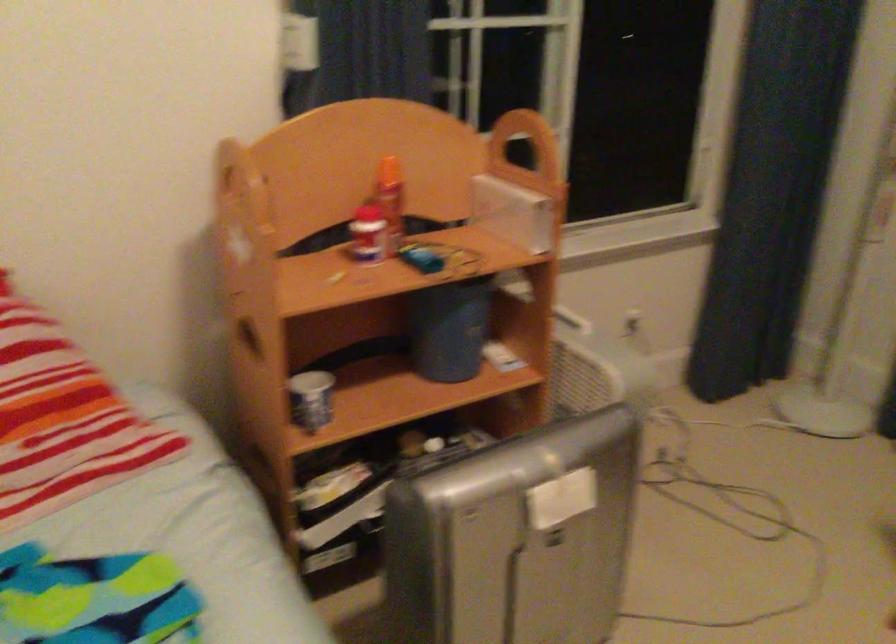
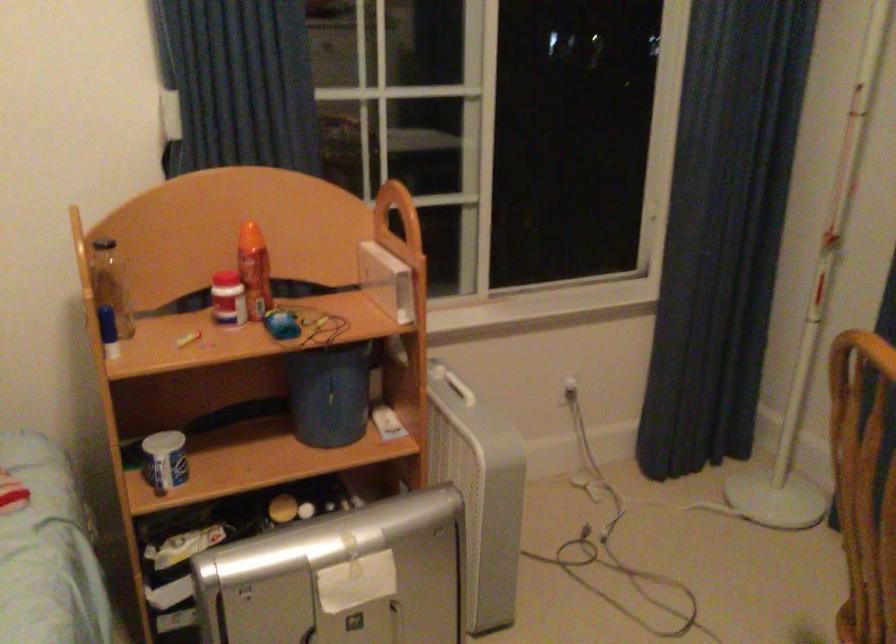
Find the pixel in the second image that matches (x=388, y=204) in the first image.

(254, 270)